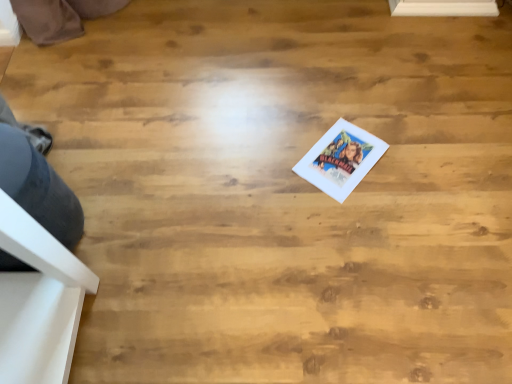
I want to click on empty space that is ontop of matte paper postcard at center (from a real-world perspective), so click(341, 158).